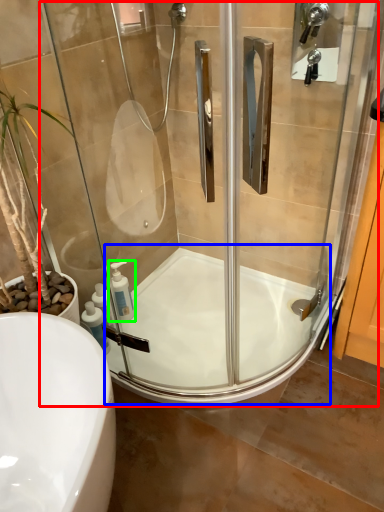
Question: Based on their relative distances, which object is farther from screen door (highlighted by a red box)? Choose from bath (highlighted by a blue box) and soap dispenser (highlighted by a green box).

Choices:
 (A) bath
 (B) soap dispenser

Answer: (B)